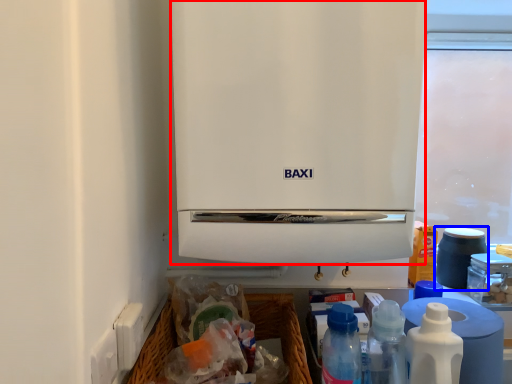
Question: Which object appears closest to the camera in this image, home appliance (highlighted by a red box) or appliance (highlighted by a blue box)?

Choices:
 (A) home appliance
 (B) appliance

Answer: (A)